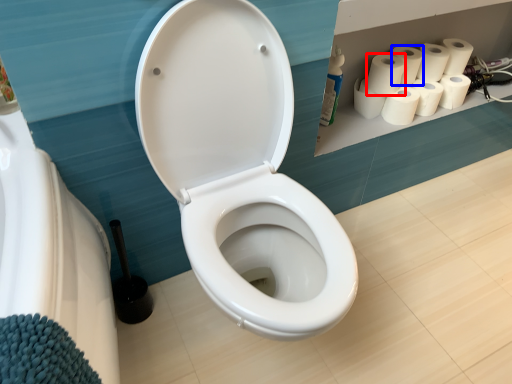
Question: Which of the following is the closest to the observer, paper towel (highlighted by a red box) or paper towel (highlighted by a blue box)?

Choices:
 (A) paper towel
 (B) paper towel

Answer: (A)